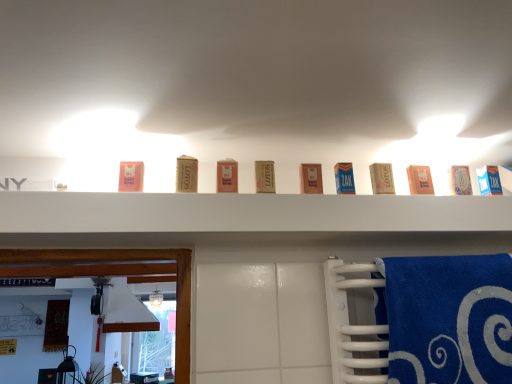
Question: In the image, is pink matte soap at upper center, positioned as the tenth product in right-to-left order, positioned in front of or behind blue cardboard box at upper right, which is the 1th product from right to left?

Choices:
 (A) behind
 (B) front

Answer: (B)

Question: In terms of width, does pink matte soap at upper center, the first product viewed from the left, look wider or thinner when compared to blue cardboard box at upper right, which is the 10th product in left-to-right order?

Choices:
 (A) wide
 (B) thin

Answer: (B)

Question: Considering the real-world distances, which object is closest to the matte cardboard box at center, the fourth product in the left-to-right sequence?

Choices:
 (A) matte brown soap at center, which is the second product from left to right
 (B) matte gold box at center, marked as the fourth product in a right-to-left arrangement
 (C) pink cardboard box at center, the 3th product when ordered from right to left
 (D) white cardboard box at upper center, placed as the ninth product when sorted from left to right
 (E) blue cardboard box at center, which appears as the fifth product when viewed from the right

Answer: (A)

Question: Estimate the real-world distances between objects in this image. Which object is farther from the blue cardboard box at center, which appears as the fifth product when viewed from the right?

Choices:
 (A) white cardboard box at upper center, which is the 2th product in right-to-left order
 (B) matte cardboard box at center, the fourth product in the left-to-right sequence
 (C) pink matte soap at upper center, positioned as the tenth product in right-to-left order
 (D) matte orange carton at center, placed as the eighth product when sorted from right to left
 (E) pink cardboard box at center, the 3th product when ordered from right to left

Answer: (C)